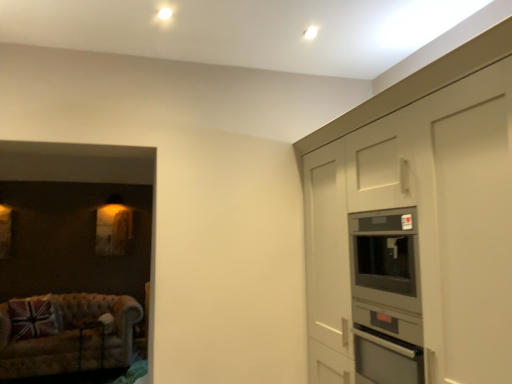
Question: From a real-world perspective, is union jack fabric pillow at lower left below matte gray cabinetry at right?

Choices:
 (A) no
 (B) yes

Answer: (B)

Question: Is union jack fabric pillow at lower left in front of matte gray cabinetry at right?

Choices:
 (A) no
 (B) yes

Answer: (A)

Question: From the image's perspective, does union jack fabric pillow at lower left appear lower than matte gray cabinetry at right?

Choices:
 (A) yes
 (B) no

Answer: (A)

Question: Could you tell me if union jack fabric pillow at lower left is facing matte gray cabinetry at right?

Choices:
 (A) yes
 (B) no

Answer: (A)

Question: Does union jack fabric pillow at lower left have a larger size compared to matte gray cabinetry at right?

Choices:
 (A) yes
 (B) no

Answer: (B)

Question: Is union jack fabric pillow at lower left wider or thinner than velvet beige couch at lower left?

Choices:
 (A) wide
 (B) thin

Answer: (B)

Question: In the image, is union jack fabric pillow at lower left on the left side or the right side of velvet beige couch at lower left?

Choices:
 (A) left
 (B) right

Answer: (A)

Question: Relative to velvet beige couch at lower left, is union jack fabric pillow at lower left in front or behind?

Choices:
 (A) front
 (B) behind

Answer: (B)

Question: Based on their sizes in the image, would you say union jack fabric pillow at lower left is bigger or smaller than velvet beige couch at lower left?

Choices:
 (A) big
 (B) small

Answer: (B)

Question: Based on their positions, is matte gray cabinetry at right located to the left or right of velvet beige couch at lower left?

Choices:
 (A) left
 (B) right

Answer: (B)

Question: In terms of size, does matte gray cabinetry at right appear bigger or smaller than velvet beige couch at lower left?

Choices:
 (A) small
 (B) big

Answer: (B)

Question: In the image, is matte gray cabinetry at right positioned in front of or behind velvet beige couch at lower left?

Choices:
 (A) front
 (B) behind

Answer: (A)

Question: In terms of height, does matte gray cabinetry at right look taller or shorter compared to velvet beige couch at lower left?

Choices:
 (A) tall
 (B) short

Answer: (A)

Question: Considering the positions of union jack fabric pillow at lower left and metallic silver table at lower left in the image, is union jack fabric pillow at lower left bigger or smaller than metallic silver table at lower left?

Choices:
 (A) small
 (B) big

Answer: (B)

Question: Relative to metallic silver table at lower left, is union jack fabric pillow at lower left in front or behind?

Choices:
 (A) behind
 (B) front

Answer: (A)